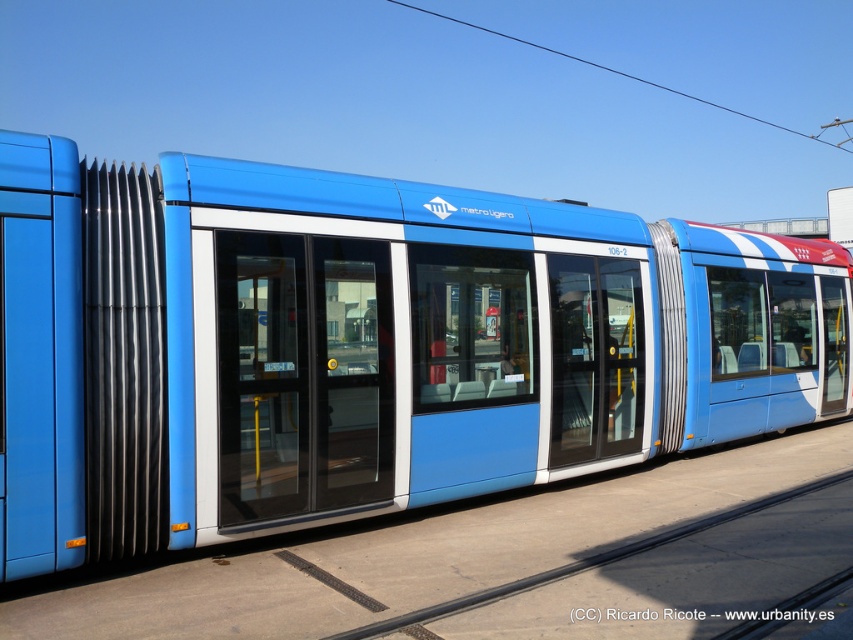
Question: Which object appears closest to the camera in this image?

Choices:
 (A) matte blue train at center
 (B) black rubber train track at center

Answer: (B)

Question: Which of the following is the farthest from the observer?

Choices:
 (A) [x=549, y=374]
 (B) [x=503, y=588]

Answer: (A)

Question: Which of the following is the farthest from the observer?

Choices:
 (A) black rubber train track at center
 (B) matte blue train at center

Answer: (B)

Question: Considering the relative positions of matte blue train at center and black rubber train track at center in the image provided, where is matte blue train at center located with respect to black rubber train track at center?

Choices:
 (A) below
 (B) above

Answer: (B)

Question: Does matte blue train at center appear on the right side of black rubber train track at center?

Choices:
 (A) yes
 (B) no

Answer: (A)

Question: Is matte blue train at center bigger than black rubber train track at center?

Choices:
 (A) no
 (B) yes

Answer: (B)